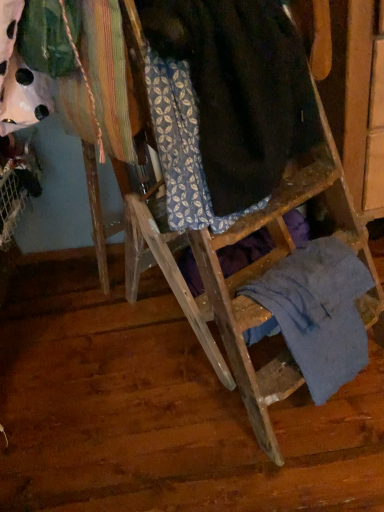
Image resolution: width=384 pixels, height=512 pixels. I want to click on blue cotton shirt at lower right, so click(316, 312).

Measure the distance between point (352, 295) and camera.

1.03 meters.

What do you see at coordinates (316, 312) in the screenshot? I see `blue cotton shirt at lower right` at bounding box center [316, 312].

What do you see at coordinates (240, 90) in the screenshot?
I see `dark brown wool at center` at bounding box center [240, 90].

What is the approximate width of dark brown wool at center?

dark brown wool at center is 19.77 inches wide.

Image resolution: width=384 pixels, height=512 pixels. Find the location of `dark brown wool at center`. dark brown wool at center is located at coordinates (240, 90).

The image size is (384, 512). Find the location of `blue cotton shirt at lower right`. blue cotton shirt at lower right is located at coordinates [316, 312].

Considering the relative positions of blue cotton shirt at lower right and dark brown wool at center in the image provided, is blue cotton shirt at lower right to the left of dark brown wool at center from the viewer's perspective?

No, blue cotton shirt at lower right is not to the left of dark brown wool at center.

Looking at this image, does blue cotton shirt at lower right lie in front of dark brown wool at center?

No, it is behind dark brown wool at center.

Which is closer, [325,356] or [214,92]?

Point [325,356] is positioned farther from the camera compared to point [214,92].

From the image's perspective, between blue cotton shirt at lower right and dark brown wool at center, who is located below?

blue cotton shirt at lower right is shown below in the image.

From a real-world perspective, relative to dark brown wool at center, is blue cotton shirt at lower right vertically above or below?

In terms of real-world spatial position, blue cotton shirt at lower right is below dark brown wool at center.

Which of these two, blue cotton shirt at lower right or dark brown wool at center, is thinner?

blue cotton shirt at lower right.

Between blue cotton shirt at lower right and dark brown wool at center, which one has less height?

With less height is blue cotton shirt at lower right.

Who is smaller, blue cotton shirt at lower right or dark brown wool at center?

With smaller size is blue cotton shirt at lower right.

Does blue cotton shirt at lower right contain dark brown wool at center?

Definitely not — dark brown wool at center is not inside blue cotton shirt at lower right.

Are blue cotton shirt at lower right and dark brown wool at center located far from each other?

That's not correct — blue cotton shirt at lower right is a little close to dark brown wool at center.

Is blue cotton shirt at lower right facing towards dark brown wool at center?

No, blue cotton shirt at lower right is not oriented towards dark brown wool at center.

You are a GUI agent. You are given a task and a screenshot of the screen. Output one action in this format:
    pyautogui.click(x=<x>, y=<y>)
    Task: Click on the wool above the blue cotton shirt at lower right (from the image's perspective)
    
    Given the screenshot: What is the action you would take?
    pyautogui.click(x=240, y=90)

Which object is positioned more to the right, dark brown wool at center or blue cotton shirt at lower right?

blue cotton shirt at lower right.

Considering the positions of objects dark brown wool at center and blue cotton shirt at lower right in the image provided, who is behind, dark brown wool at center or blue cotton shirt at lower right?

Positioned behind is blue cotton shirt at lower right.

Is point (240, 94) closer to camera compared to point (291, 351)?

Yes, point (240, 94) is closer to viewer.

From the image's perspective, between dark brown wool at center and blue cotton shirt at lower right, who is located below?

From the image's view, blue cotton shirt at lower right is below.

From a real-world perspective, relative to blue cotton shirt at lower right, is dark brown wool at center vertically above or below?

In terms of real-world spatial position, dark brown wool at center is above blue cotton shirt at lower right.

Based on the photo, does dark brown wool at center have a lesser width compared to blue cotton shirt at lower right?

Incorrect, the width of dark brown wool at center is not less than that of blue cotton shirt at lower right.

Is dark brown wool at center taller or shorter than blue cotton shirt at lower right?

dark brown wool at center is taller than blue cotton shirt at lower right.

Can you confirm if dark brown wool at center is bigger than blue cotton shirt at lower right?

Yes, dark brown wool at center is bigger than blue cotton shirt at lower right.

Can blue cotton shirt at lower right be found inside dark brown wool at center?

No, blue cotton shirt at lower right is not a part of dark brown wool at center.

Is dark brown wool at center positioned far away from blue cotton shirt at lower right?

dark brown wool at center is near blue cotton shirt at lower right, not far away.

Is dark brown wool at center turned away from blue cotton shirt at lower right?

That's not correct — dark brown wool at center is not looking away from blue cotton shirt at lower right.

Can you tell me how much dark brown wool at center and blue cotton shirt at lower right differ in facing direction?

0.00102 degrees.

The height and width of the screenshot is (512, 384). I want to click on underclothes beneath the dark brown wool at center (from a real-world perspective), so click(316, 312).

Where is `underclothes lying below the dark brown wool at center (from the image's perspective)`? Image resolution: width=384 pixels, height=512 pixels. underclothes lying below the dark brown wool at center (from the image's perspective) is located at coordinates (316, 312).

Image resolution: width=384 pixels, height=512 pixels. I want to click on underclothes below the dark brown wool at center (from a real-world perspective), so click(316, 312).